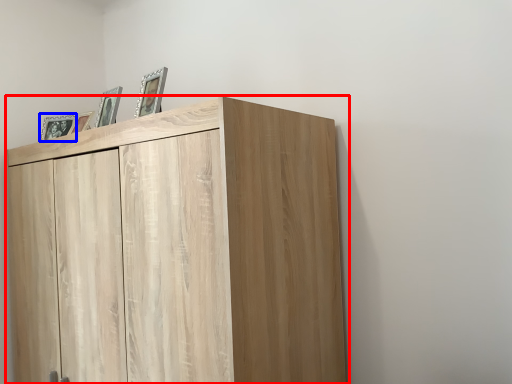
Question: Among these objects, which one is farthest to the camera, cupboard (highlighted by a red box) or picture frame (highlighted by a blue box)?

Choices:
 (A) cupboard
 (B) picture frame

Answer: (B)